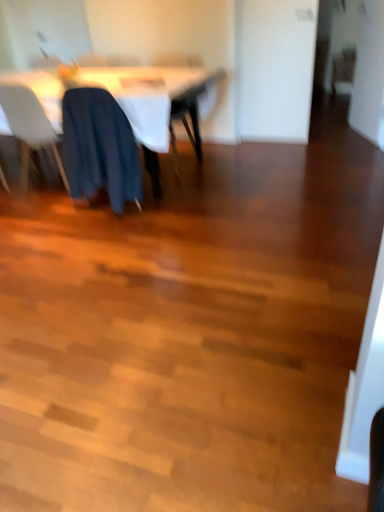
Image resolution: width=384 pixels, height=512 pixels. I want to click on white plastic chair at left, placed as the 4th chair when sorted from right to left, so click(x=29, y=127).

Identify the location of dark blue fabric chair at center, positioned as the third chair in front-to-back order. (187, 122).

Identify the location of dark blue fabric at center, the fourth chair viewed from the back. (99, 148).

Locate an element on the screen. wooden chair at upper right, which ranks as the fourth chair in left-to-right order is located at coordinates (343, 69).

Image resolution: width=384 pixels, height=512 pixels. What are the coordinates of `white plastic chair at left, placed as the 4th chair when sorted from right to left` in the screenshot? It's located at [29, 127].

From the image's perspective, which one is positioned lower, dark blue fabric at center, acting as the second chair starting from the left, or white plastic chair at left, placed as the 4th chair when sorted from right to left?

From the image's view, dark blue fabric at center, acting as the second chair starting from the left, is below.

Between dark blue fabric at center, the fourth chair viewed from the back, and white plastic chair at left, positioned as the third chair in back-to-front order, which one has more height?

white plastic chair at left, positioned as the third chair in back-to-front order, is taller.

Based on the photo, what's the angular difference between dark blue fabric at center, the 3th chair from the right, and white plastic chair at left, marked as the first chair in a left-to-right arrangement,'s facing directions?

There is a 0.182-degree angle between the facing directions of dark blue fabric at center, the 3th chair from the right, and white plastic chair at left, marked as the first chair in a left-to-right arrangement.

Is there a large distance between dark blue fabric at center, the 3th chair from the right, and white plastic chair at left, which is counted as the 2th chair, starting from the front?

That's not correct — dark blue fabric at center, the 3th chair from the right, is a little close to white plastic chair at left, which is counted as the 2th chair, starting from the front.

Is point (350, 89) closer or farther from the camera than point (169, 62)?

Point (350, 89) is positioned farther from the camera compared to point (169, 62).

Image resolution: width=384 pixels, height=512 pixels. Find the location of `chair to the right of dark blue fabric chair at center, positioned as the third chair in front-to-back order`. chair to the right of dark blue fabric chair at center, positioned as the third chair in front-to-back order is located at coordinates (343, 69).

In the scene shown: Could dark blue fabric chair at center, acting as the third chair starting from the left, be considered to be inside wooden chair at upper right, the fourth chair from the front?

No, dark blue fabric chair at center, acting as the third chair starting from the left, is not surrounded by wooden chair at upper right, the fourth chair from the front.

From the image's perspective, is wooden chair at upper right, which ranks as the fourth chair in left-to-right order, beneath dark blue fabric chair at center, acting as the second chair starting from the right?

No, from the image's perspective, wooden chair at upper right, which ranks as the fourth chair in left-to-right order, is not below dark blue fabric chair at center, acting as the second chair starting from the right.

Is white fabric table at upper left taller than white plastic chair at left, marked as the first chair in a left-to-right arrangement?

No, white fabric table at upper left is not taller than white plastic chair at left, marked as the first chair in a left-to-right arrangement.

Does white fabric table at upper left appear on the right side of white plastic chair at left, positioned as the third chair in back-to-front order?

Yes, white fabric table at upper left is to the right of white plastic chair at left, positioned as the third chair in back-to-front order.

Is white fabric table at upper left directly adjacent to white plastic chair at left, marked as the first chair in a left-to-right arrangement?

No, white fabric table at upper left is not with white plastic chair at left, marked as the first chair in a left-to-right arrangement.

Do you think white fabric table at upper left is within white plastic chair at left, marked as the first chair in a left-to-right arrangement, or outside of it?

white fabric table at upper left lies outside white plastic chair at left, marked as the first chair in a left-to-right arrangement.

Which object is positioned more to the left, dark blue fabric chair at center, positioned as the third chair in front-to-back order, or wooden chair at upper right, which is counted as the first chair, starting from the back?

dark blue fabric chair at center, positioned as the third chair in front-to-back order, is more to the left.

Is dark blue fabric chair at center, positioned as the third chair in front-to-back order, facing towards wooden chair at upper right, which ranks as the 1th chair in right-to-left order?

No.

In the scene shown: From a real-world perspective, between dark blue fabric chair at center, acting as the third chair starting from the left, and wooden chair at upper right, which ranks as the fourth chair in left-to-right order, who is vertically higher?

In real-world perspective, dark blue fabric chair at center, acting as the third chair starting from the left, is above.

Is dark blue fabric at center, the 3th chair from the right, bigger or smaller than wooden chair at upper right, the fourth chair from the front?

dark blue fabric at center, the 3th chair from the right, is bigger than wooden chair at upper right, the fourth chair from the front.

What's the angular difference between dark blue fabric at center, the first chair viewed from the front, and wooden chair at upper right, which ranks as the fourth chair in left-to-right order,'s facing directions?

The angle between the facing direction of dark blue fabric at center, the first chair viewed from the front, and the facing direction of wooden chair at upper right, which ranks as the fourth chair in left-to-right order, is 178 degrees.

Is wooden chair at upper right, the fourth chair from the front, a part of dark blue fabric at center, acting as the second chair starting from the left?

No, wooden chair at upper right, the fourth chair from the front, is not inside dark blue fabric at center, acting as the second chair starting from the left.

From a real-world perspective, which is physically below, dark blue fabric at center, acting as the second chair starting from the left, or wooden chair at upper right, which is counted as the first chair, starting from the back?

From a 3D spatial view, wooden chair at upper right, which is counted as the first chair, starting from the back, is below.

Is dark blue fabric at center, the first chair viewed from the front, inside or outside of dark blue fabric chair at center, positioned as the third chair in front-to-back order?

dark blue fabric at center, the first chair viewed from the front, is spatially situated outside dark blue fabric chair at center, positioned as the third chair in front-to-back order.

Which object is further away from the camera taking this photo, dark blue fabric at center, acting as the second chair starting from the left, or dark blue fabric chair at center, placed as the 2th chair when sorted from back to front?

dark blue fabric chair at center, placed as the 2th chair when sorted from back to front, is further away from the camera.

Looking at their sizes, would you say dark blue fabric at center, acting as the second chair starting from the left, is wider or thinner than dark blue fabric chair at center, acting as the third chair starting from the left?

Considering their sizes, dark blue fabric at center, acting as the second chair starting from the left, looks slimmer than dark blue fabric chair at center, acting as the third chair starting from the left.

Considering their positions, is dark blue fabric chair at center, acting as the third chair starting from the left, located in front of or behind white plastic chair at left, marked as the first chair in a left-to-right arrangement?

Clearly, dark blue fabric chair at center, acting as the third chair starting from the left, is behind white plastic chair at left, marked as the first chair in a left-to-right arrangement.

From the image's perspective, would you say dark blue fabric chair at center, acting as the third chair starting from the left, is positioned over white plastic chair at left, placed as the 4th chair when sorted from right to left?

Yes, from the image's perspective, dark blue fabric chair at center, acting as the third chair starting from the left, is on top of white plastic chair at left, placed as the 4th chair when sorted from right to left.

Looking at this image, from a real-world perspective, is dark blue fabric chair at center, acting as the third chair starting from the left, above or below white plastic chair at left, placed as the 4th chair when sorted from right to left?

dark blue fabric chair at center, acting as the third chair starting from the left, is situated higher than white plastic chair at left, placed as the 4th chair when sorted from right to left, in the real world.

Is dark blue fabric chair at center, acting as the third chair starting from the left, smaller than white plastic chair at left, marked as the first chair in a left-to-right arrangement?

Yes, dark blue fabric chair at center, acting as the third chair starting from the left, is smaller than white plastic chair at left, marked as the first chair in a left-to-right arrangement.

Find the location of a particular element. chair on the left of dark blue fabric at center, the fourth chair viewed from the back is located at coordinates (29, 127).

In the image, there is a dark blue fabric chair at center, acting as the third chair starting from the left. What are the coordinates of `chair above it (from the image's perspective)` in the screenshot? It's located at (343, 69).

Which object lies further to the anchor point wooden chair at upper right, which ranks as the fourth chair in left-to-right order, dark blue fabric chair at center, placed as the 2th chair when sorted from back to front, or white fabric table at upper left?

The object further to wooden chair at upper right, which ranks as the fourth chair in left-to-right order, is white fabric table at upper left.

Looking at the image, which one is located further to dark blue fabric chair at center, acting as the third chair starting from the left, wooden chair at upper right, the fourth chair from the front, or white plastic chair at left, marked as the first chair in a left-to-right arrangement?

wooden chair at upper right, the fourth chair from the front, lies further to dark blue fabric chair at center, acting as the third chair starting from the left, than the other object.

Looking at this image, based on their spatial positions, is dark blue fabric chair at center, positioned as the third chair in front-to-back order, or wooden chair at upper right, which is counted as the first chair, starting from the back, further from white plastic chair at left, placed as the 4th chair when sorted from right to left?

wooden chair at upper right, which is counted as the first chair, starting from the back, is further to white plastic chair at left, placed as the 4th chair when sorted from right to left.

Looking at the image, which one is located closer to white plastic chair at left, which is counted as the 2th chair, starting from the front, white fabric table at upper left or dark blue fabric chair at center, placed as the 2th chair when sorted from back to front?

Among the two, white fabric table at upper left is located nearer to white plastic chair at left, which is counted as the 2th chair, starting from the front.

Estimate the real-world distances between objects in this image. Which object is closer to white fabric table at upper left, white plastic chair at left, which is counted as the 2th chair, starting from the front, or wooden chair at upper right, which ranks as the fourth chair in left-to-right order?

The object closer to white fabric table at upper left is white plastic chair at left, which is counted as the 2th chair, starting from the front.

When comparing their distances from wooden chair at upper right, the fourth chair from the front, does white plastic chair at left, placed as the 4th chair when sorted from right to left, or dark blue fabric chair at center, positioned as the third chair in front-to-back order, seem further?

Based on the image, white plastic chair at left, placed as the 4th chair when sorted from right to left, appears to be further to wooden chair at upper right, the fourth chair from the front.

Considering their positions, is white plastic chair at left, placed as the 4th chair when sorted from right to left, positioned closer to dark blue fabric at center, acting as the second chair starting from the left, than dark blue fabric chair at center, placed as the 2th chair when sorted from back to front?

Among the two, white plastic chair at left, placed as the 4th chair when sorted from right to left, is located nearer to dark blue fabric at center, acting as the second chair starting from the left.

From the image, which object appears to be farther from white plastic chair at left, positioned as the third chair in back-to-front order, dark blue fabric at center, the 3th chair from the right, or dark blue fabric chair at center, acting as the second chair starting from the right?

dark blue fabric chair at center, acting as the second chair starting from the right, is positioned further to the anchor white plastic chair at left, positioned as the third chair in back-to-front order.

The image size is (384, 512). Identify the location of table between white plastic chair at left, marked as the first chair in a left-to-right arrangement, and dark blue fabric at center, acting as the second chair starting from the left. (133, 98).

You are a GUI agent. You are given a task and a screenshot of the screen. Output one action in this format:
    pyautogui.click(x=<x>, y=<y>)
    Task: Click on the chair between white fabric table at upper left and dark blue fabric chair at center, placed as the 2th chair when sorted from back to front, in the horizontal direction
    
    Given the screenshot: What is the action you would take?
    pyautogui.click(x=99, y=148)

Locate an element on the screen. table situated between white plastic chair at left, positioned as the third chair in back-to-front order, and wooden chair at upper right, which ranks as the 1th chair in right-to-left order, from left to right is located at coordinates (133, 98).

The height and width of the screenshot is (512, 384). Find the location of `table between white plastic chair at left, which is counted as the 2th chair, starting from the front, and dark blue fabric chair at center, acting as the second chair starting from the right, in the horizontal direction`. table between white plastic chair at left, which is counted as the 2th chair, starting from the front, and dark blue fabric chair at center, acting as the second chair starting from the right, in the horizontal direction is located at coordinates [133, 98].